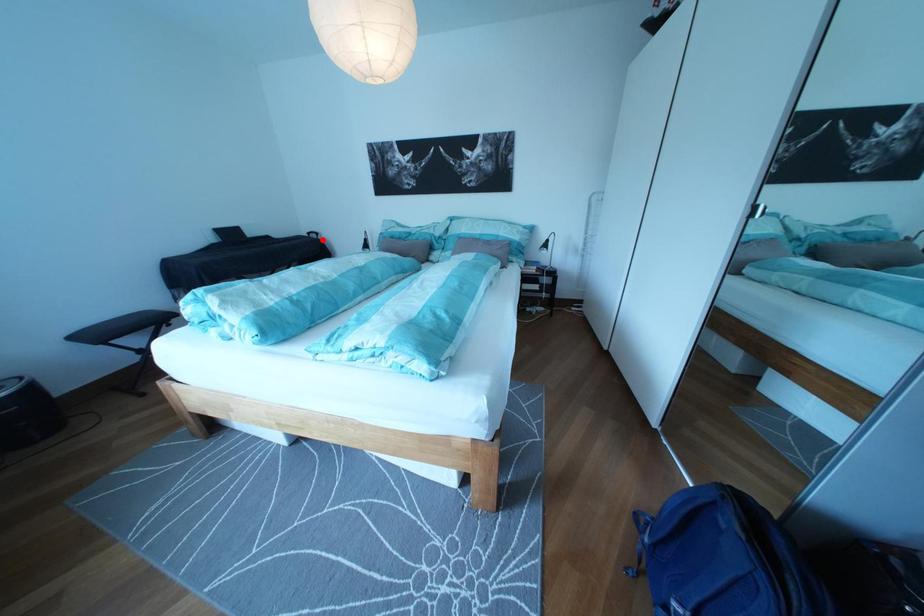
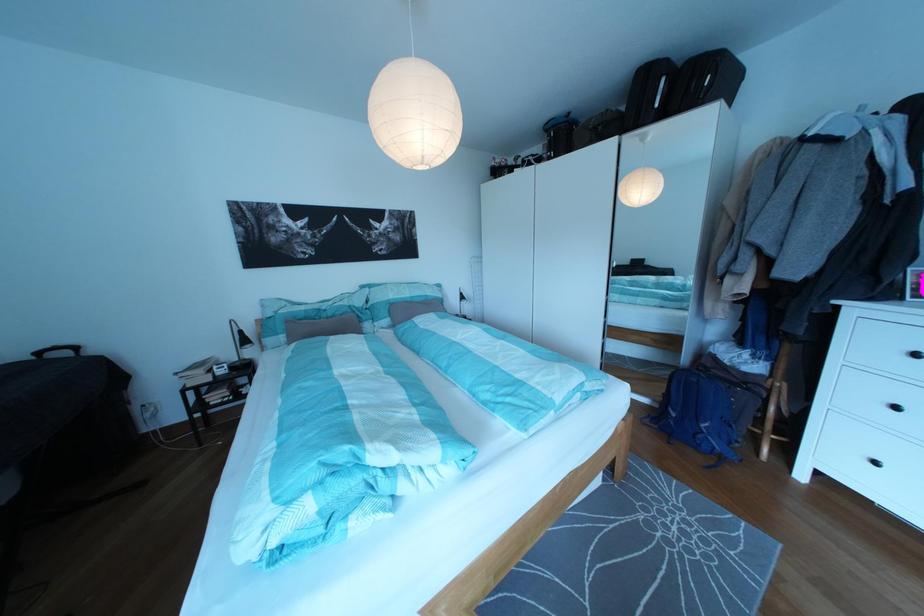
The point at the highlighted location is marked in the first image. Where is the corresponding point in the second image?

(53, 360)